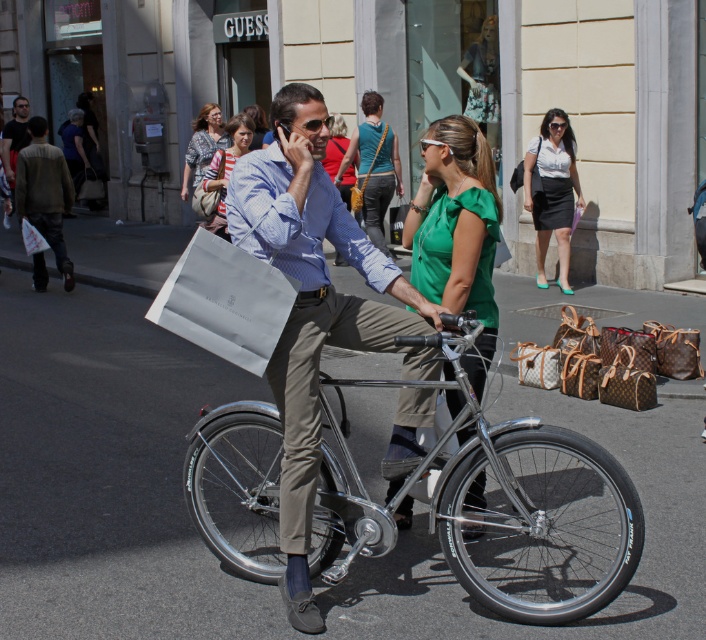
Which is above, green matte shirt at center or matte white bag at left?

Positioned higher is matte white bag at left.

Between point (454, 234) and point (6, 216), which one is positioned behind?

Point (6, 216)

This screenshot has width=706, height=640. I want to click on green matte shirt at center, so click(x=455, y=230).

Measure the distance between point (x=381, y=106) and camera.

The distance of point (x=381, y=106) from camera is 13.74 meters.

Is teal fabric purse at center bigger than matte white bag at center?

Correct, teal fabric purse at center is larger in size than matte white bag at center.

Does point (359, 147) lie in front of point (261, 129)?

Yes, it is.

Locate an element on the screen. This screenshot has height=640, width=706. teal fabric purse at center is located at coordinates (373, 166).

Who is more distant from viewer, (237, 152) or (209, 124)?

The point (209, 124) is behind.

Is point (210, 216) positioned behind point (203, 106)?

That is False.

Locate an element on the screen. The height and width of the screenshot is (640, 706). matte striped shirt at center is located at coordinates (227, 170).